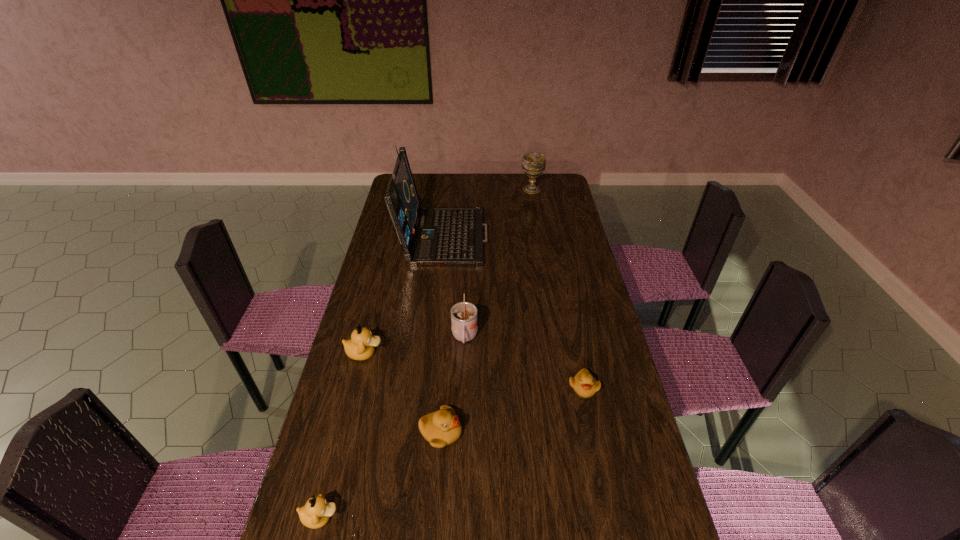
You are a GUI agent. You are given a task and a screenshot of the screen. Output one action in this format:
    pyautogui.click(x=<x>, y=<y>)
    Task: Click on the second farthest object
    The height and width of the screenshot is (540, 960).
    Given the screenshot: What is the action you would take?
    pyautogui.click(x=429, y=236)

Where is `laptop computer`? laptop computer is located at coordinates [429, 236].

Locate an element on the screen. chalice is located at coordinates (534, 163).

What are the coordinates of `white chalice` in the screenshot? It's located at (534, 163).

Identify the location of cup. (464, 321).

Where is `the fourth shortest object`? Image resolution: width=960 pixels, height=540 pixels. the fourth shortest object is located at coordinates (361, 346).

Locate an element on the screen. This screenshot has height=540, width=960. the farthest duckling is located at coordinates (361, 346).

Locate an element on the screen. The height and width of the screenshot is (540, 960). the sixth farthest object is located at coordinates [440, 428].

What are the coordinates of `the nearer yellow duckling` in the screenshot? It's located at (440, 428).

The width and height of the screenshot is (960, 540). Find the location of `the nearest object`. the nearest object is located at coordinates (316, 513).